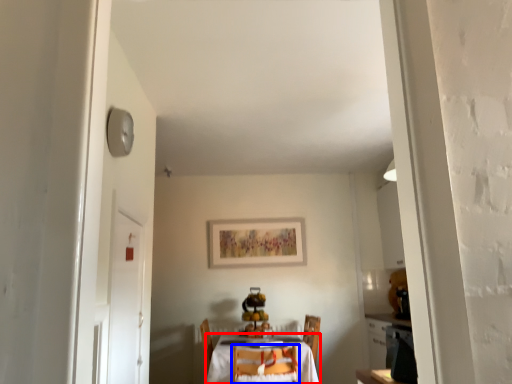
Question: Which point is closer to the camera, table (highlighted by a red box) or chair (highlighted by a blue box)?

Choices:
 (A) table
 (B) chair

Answer: (B)